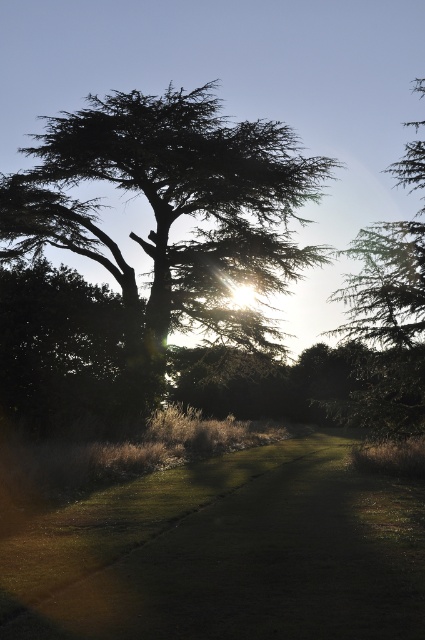
Question: Which is farther from the green textured tree at upper right?

Choices:
 (A) green grass at center
 (B) green leafy tree at center

Answer: (B)

Question: In this image, where is green grass at center located relative to green leafy tree at center?

Choices:
 (A) left
 (B) right

Answer: (B)

Question: Considering the real-world distances, which object is closest to the green grass at center?

Choices:
 (A) green leafy tree at center
 (B) green textured tree at upper right

Answer: (B)

Question: Estimate the real-world distances between objects in this image. Which object is closer to the green textured tree at upper right?

Choices:
 (A) green leafy tree at center
 (B) green grass at center

Answer: (B)

Question: Observing the image, what is the correct spatial positioning of green leafy tree at center in reference to green textured tree at upper right?

Choices:
 (A) below
 (B) above

Answer: (B)

Question: Does green grass at center come behind green textured tree at upper right?

Choices:
 (A) no
 (B) yes

Answer: (A)